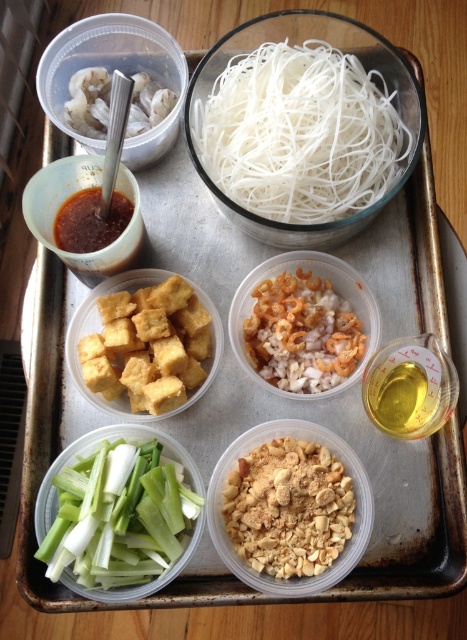
You are a chef preparing a dish and need to quickly access both the satin brown sauce at upper left and the white glossy shrimp at upper left. Given that your reach is 6 inches, can you comfortably reach both items without moving your position?

The distance between the satin brown sauce at upper left and the white glossy shrimp at upper left is 6.51 inches. Since your reach is 6 inches, you cannot comfortably reach both items without moving your position.

You are a chef preparing a dish and need to choose between the satin brown sauce at upper left and the white glossy shrimp at upper left. Which one has a larger volume?

The white glossy shrimp at upper left has a larger volume than the satin brown sauce at upper left.